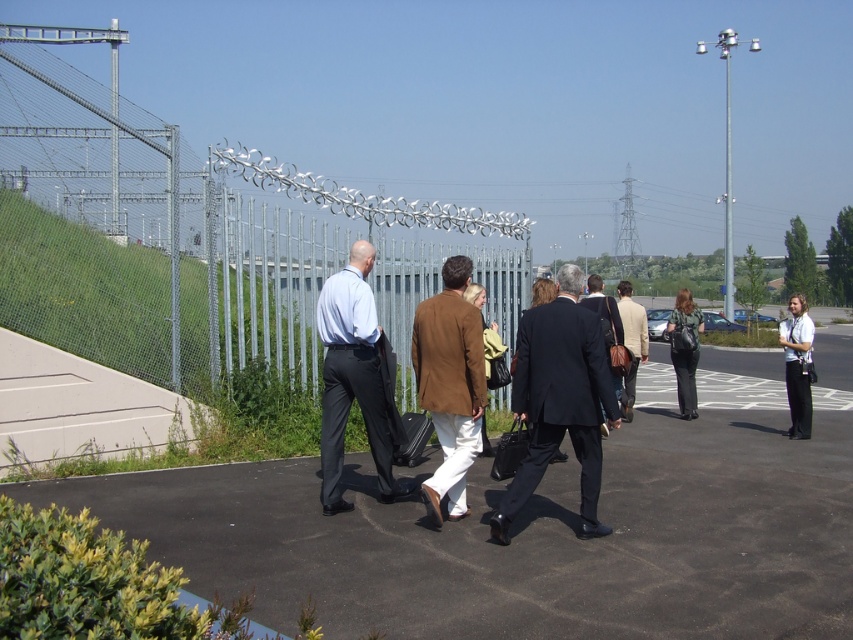
Does black asphalt at center come in front of metallic chain-link fence at upper left?

Yes, it is in front of metallic chain-link fence at upper left.

At what (x,y) coordinates should I click in order to perform the action: click on black asphalt at center. Please return your answer as a coordinate pair (x, y). Looking at the image, I should click on (543, 525).

Looking at this image, is metallic chain-link fence at upper left above white fabric camera at right?

Correct, metallic chain-link fence at upper left is located above white fabric camera at right.

Can you confirm if metallic chain-link fence at upper left is positioned to the left of white fabric camera at right?

Correct, you'll find metallic chain-link fence at upper left to the left of white fabric camera at right.

Locate an element on the screen. Image resolution: width=853 pixels, height=640 pixels. metallic chain-link fence at upper left is located at coordinates (184, 236).

Measure the distance between black asphalt at center and camera.

black asphalt at center and camera are 4.14 meters apart from each other.

Identify the location of black asphalt at center. This screenshot has height=640, width=853. (543, 525).